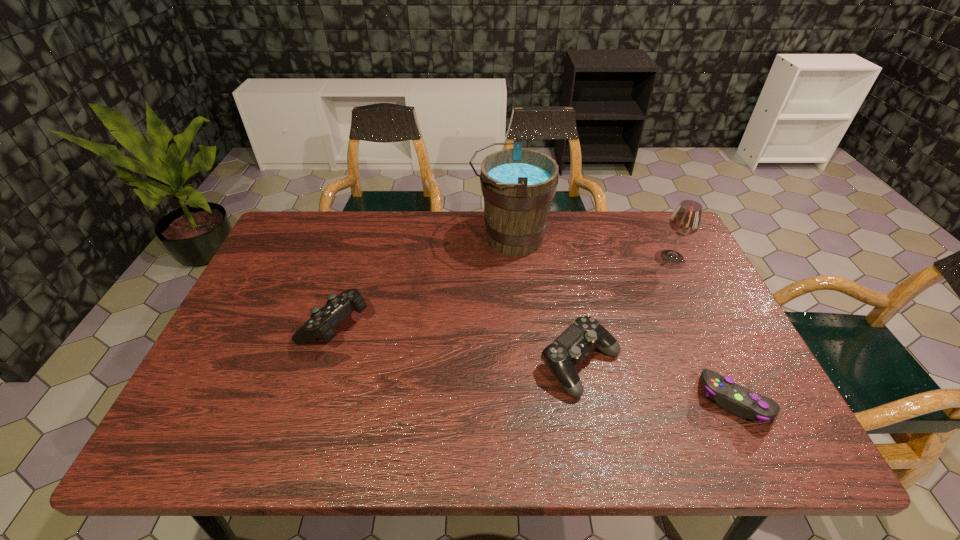
Locate an element on the screen. Image resolution: width=960 pixels, height=540 pixels. unoccupied position between the wineglass and the leftmost object is located at coordinates (503, 291).

Identify the location of vacant space in between the second control from left to right and the leftmost object. Image resolution: width=960 pixels, height=540 pixels. (458, 345).

At what (x,y) coordinates should I click in order to perform the action: click on free space between the wine bucket and the second control from left to right. Please return your answer as a coordinate pair (x, y). The image size is (960, 540). Looking at the image, I should click on (545, 301).

You are a GUI agent. You are given a task and a screenshot of the screen. Output one action in this format:
    pyautogui.click(x=<x>, y=<y>)
    Task: Click on the empty space between the leftmost object and the second tallest object
    
    Given the screenshot: What is the action you would take?
    503,291

At what (x,y) coordinates should I click in order to perform the action: click on free spot between the second control from right to left and the tallest object. Please return your answer as a coordinate pair (x, y). Looking at the image, I should click on (545, 301).

Identify which object is located as the third nearest to the second control from left to right. Please provide its 2D coordinates. Your answer should be formatted as a tuple, i.e. [(x, y)], where the tuple contains the x and y coordinates of a point satisfying the conditions above.

[(686, 220)]

This screenshot has height=540, width=960. What are the coordinates of `object that is the second closest to the tallest object` in the screenshot? It's located at (320, 325).

Identify which control is the nearest to the leftmost control. Please provide its 2D coordinates. Your answer should be formatted as a tuple, i.e. [(x, y)], where the tuple contains the x and y coordinates of a point satisfying the conditions above.

[(567, 351)]

Where is `the closest control to the wine bucket`? the closest control to the wine bucket is located at coordinates (567, 351).

Where is `blank area in the image that satisfies the following two spatial constraints: 1. with a handle on the side of the tallest object; 2. on the right side of the second control from right to left`? The height and width of the screenshot is (540, 960). blank area in the image that satisfies the following two spatial constraints: 1. with a handle on the side of the tallest object; 2. on the right side of the second control from right to left is located at coordinates (520, 364).